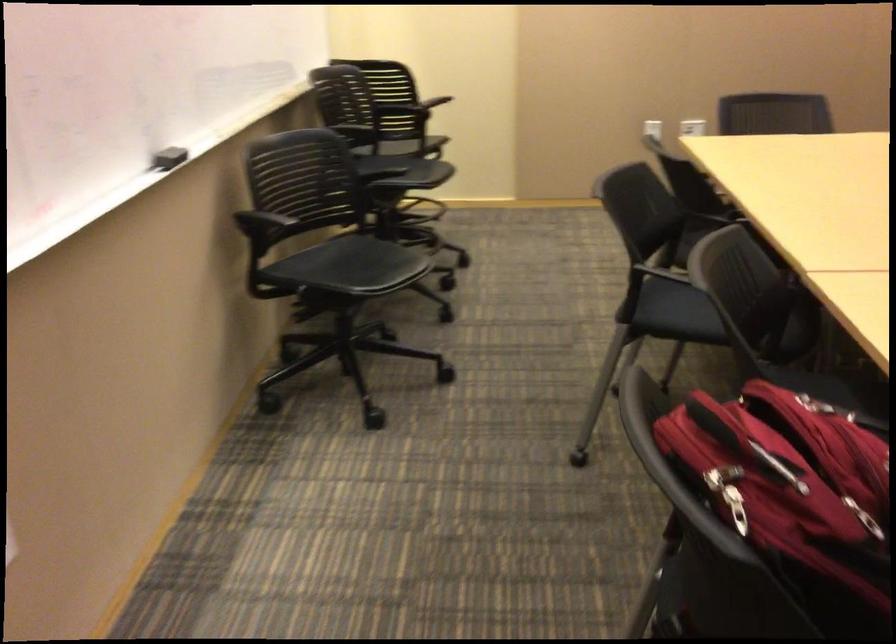
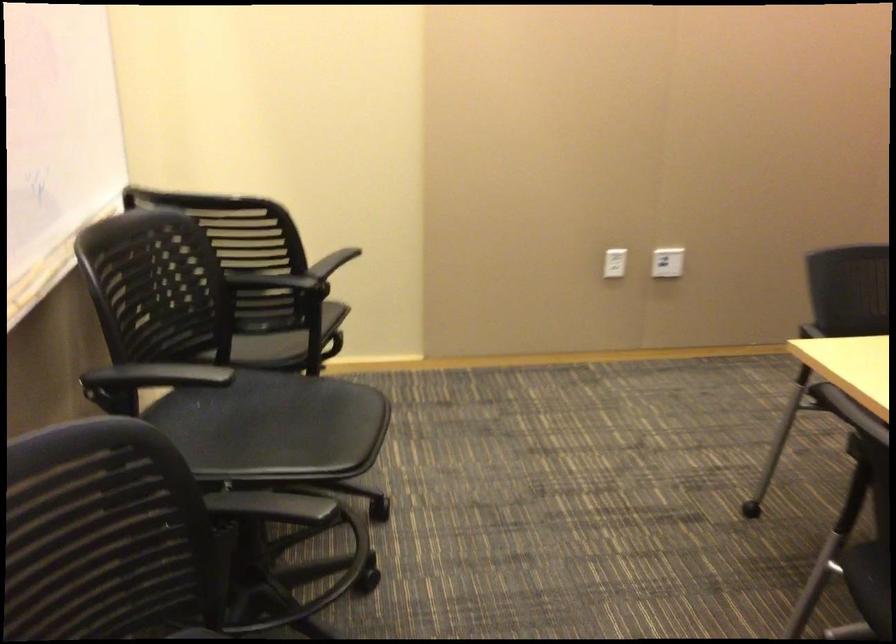
Find the pixel in the second image that matches point (703, 127) in the first image.

(667, 261)